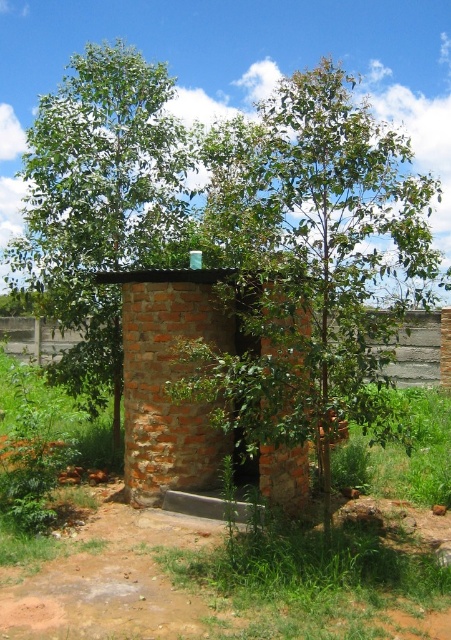
Consider the image. You are a gardener who wants to plant a new tree near the brick hut at center. Considering the green leafy tree at center already exists, which tree has a wider spread in terms of width?

The green leafy tree at center has a wider spread than the brick hut at center.

You are standing in front of the brick structure and want to determine the distance between two points marked on the structure. The first point is at coordinate point (179, 147) and the second is at point (385, 369). Based on their positions, which point is nearer to you?

Point (179, 147) is closer to the camera than point (385, 369), so the first point is nearer to you.

You are standing at the point marked as point (100,204) in the image. What do you see directly in front of you?

You see the green leafy tree at left directly in front of you because point (100,204) corresponds to that location.